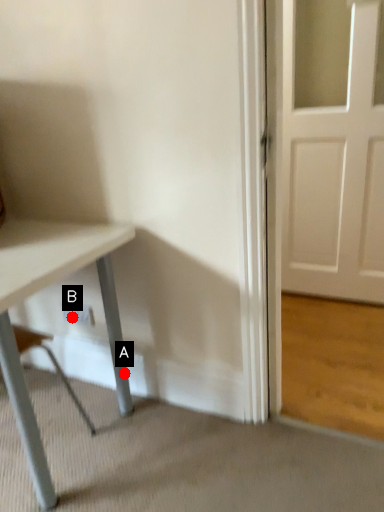
Question: Two points are circled on the image, labeled by A and B beside each circle. Which point appears farthest from the camera in this image?

Choices:
 (A) A is further
 (B) B is further

Answer: (B)